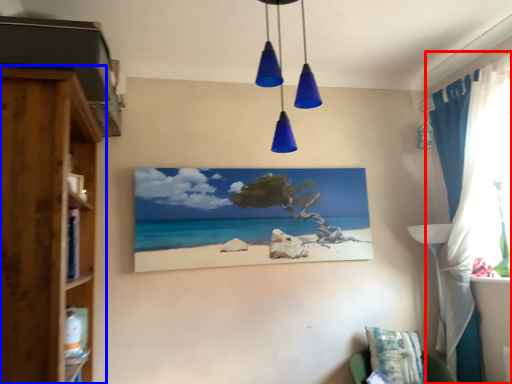
Question: Which object is further to the camera taking this photo, curtain (highlighted by a red box) or cupboard (highlighted by a blue box)?

Choices:
 (A) curtain
 (B) cupboard

Answer: (A)